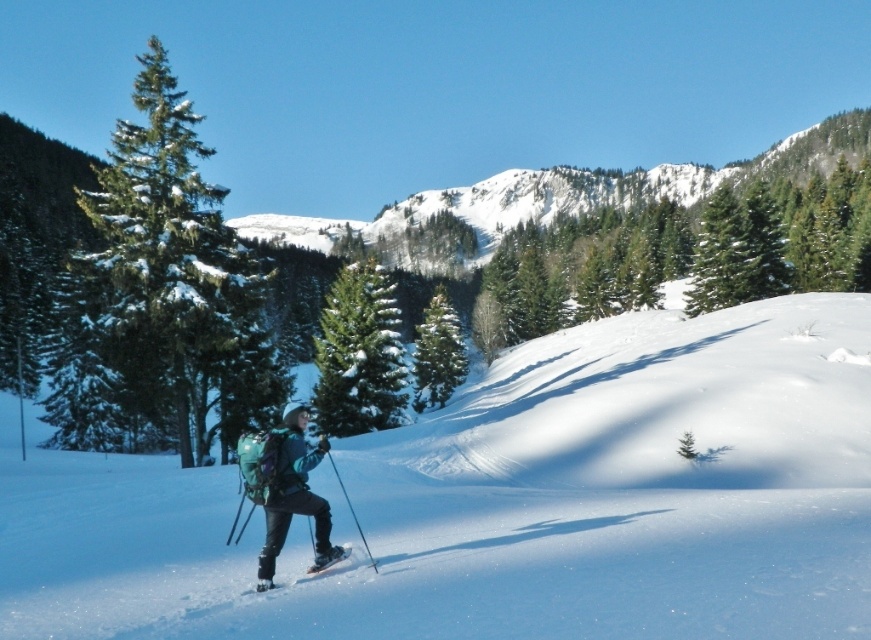
You are a hiker trying to navigate through the forest. You see a green evergreen tree at left and a green textured pine at center. Which tree is closer to the left edge of the path?

The green evergreen tree at left is closer to the left edge of the path because it is positioned on the left side of the green textured pine at center.

You are a photographer planning to take a photo of the green textured pine tree at center and the shiny black ski at lower center. Since the pine tree is blocking the ski, can you adjust your camera angle to capture both objects without any obstruction?

The green textured pine tree at center is positioned over the shiny black ski at lower center. To capture both without obstruction, you can lower the camera angle to frame the ski below the tree or move to a position where the tree and ski are side by side.